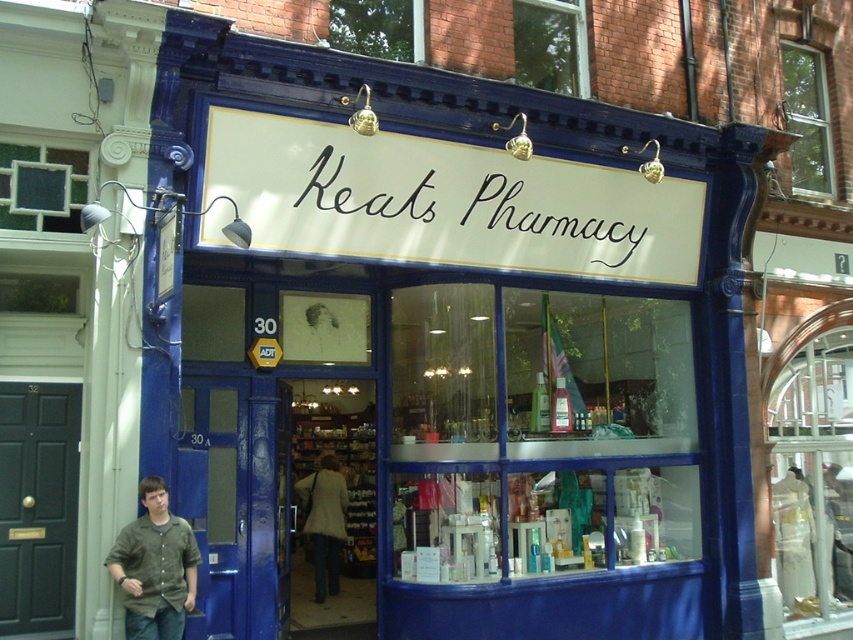
You are a customer entering Keats Pharmacy and looking at the items inside. Which item is positioned higher up, the white painted wood sign at center or the green cotton shirt at lower left?

The white painted wood sign at center is above the green cotton shirt at lower left, so it is positioned higher up.

You are standing outside Keats Pharmacy and looking at the entrance. There are two points marked on the facade. One is at coordinate point [404,234] and the other is at point [178,563]. Which point is closer to you?

Point [404,234] is closer to you because it is further to the viewer than point [178,563].